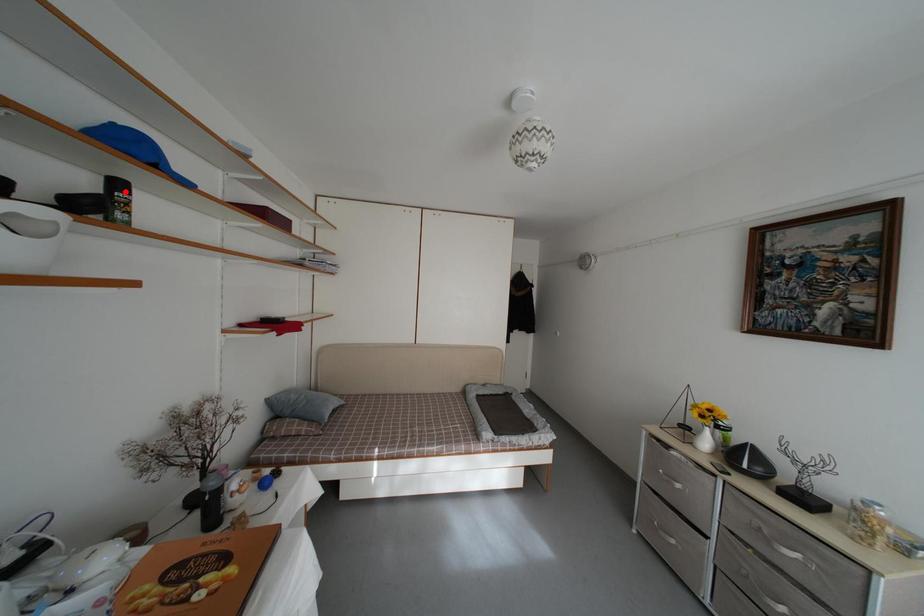
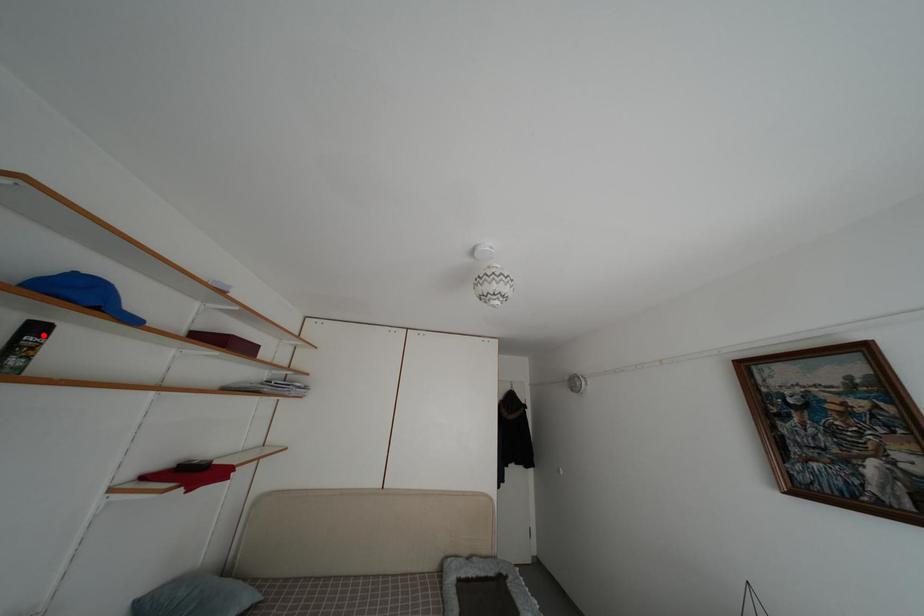
I am providing you with two images of the same scene from different viewpoints. A red point is marked on the first image and another point is marked on the second image. Does the point marked in image1 correspond to the same location as the one in image2?

Yes